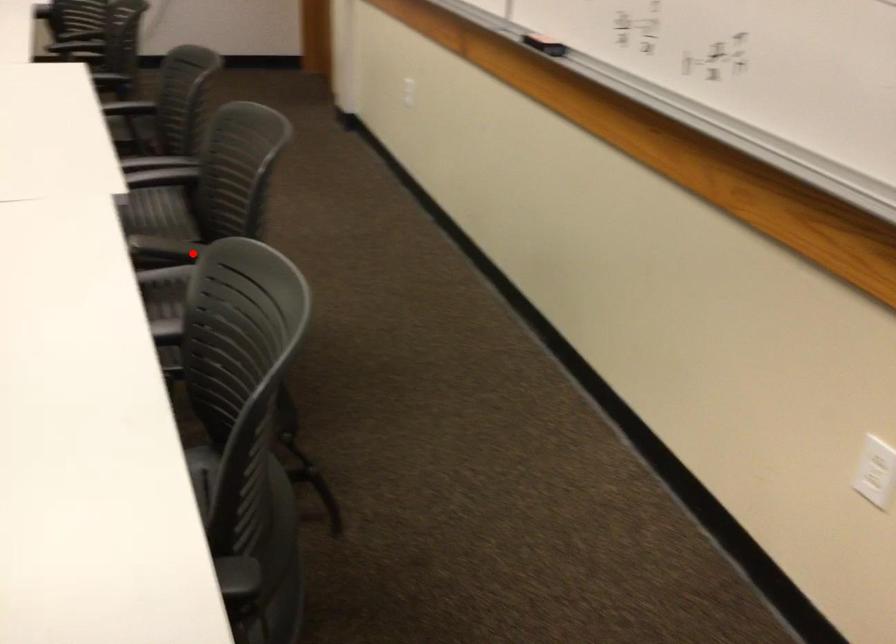
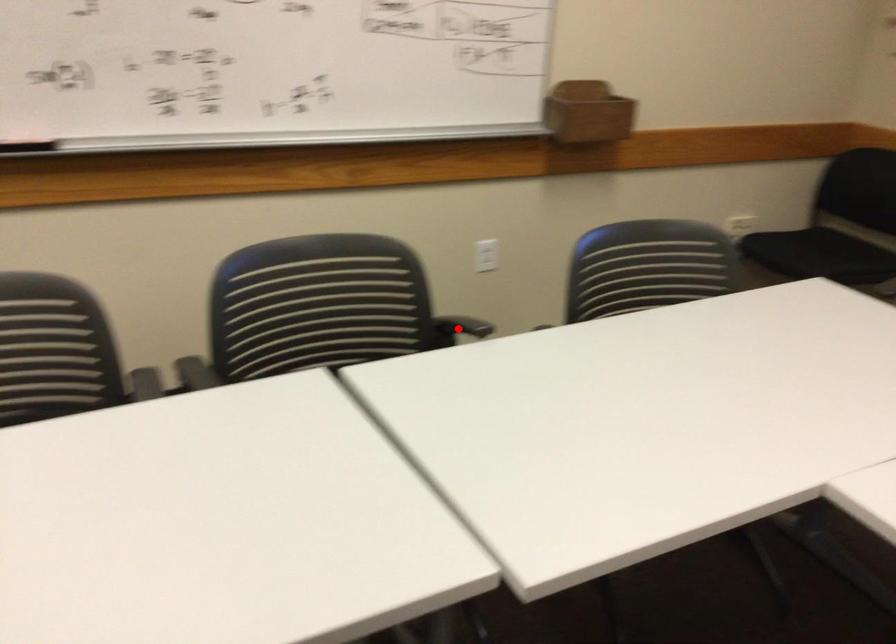
I am providing you with two images of the same scene from different viewpoints. A red point is marked on the first image and another point is marked on the second image. Is the marked point in image1 the same physical position as the marked point in image2?

Yes